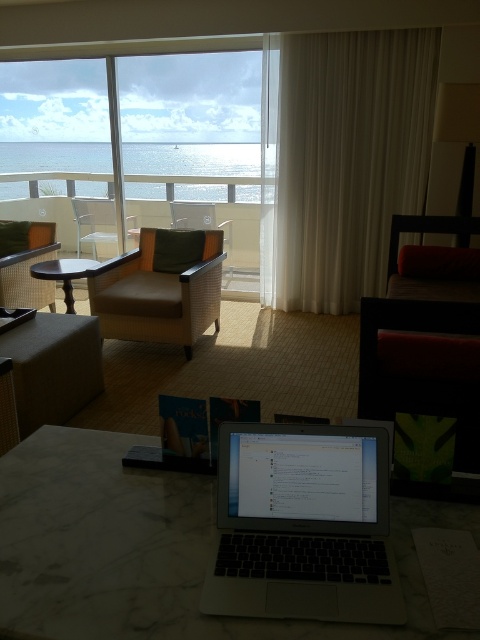
You are standing in the room and want to pick up an object located at point (342, 502) and another object at point (90, 228). Which point do you need to walk closer to first to reach them?

You should first walk closer to point (342, 502) because it is closer to you than point (90, 228).

You are a guest in this room and want to know which object is larger between the white sheer curtain at right and the matte brown armchair at center. Can you tell me?

The white sheer curtain at right is bigger than the matte brown armchair at center according to the description.

You are a guest in this room and want to know which object is taller between the white sheer curtain at right and the matte brown armchair at center. Can you tell me?

The white sheer curtain at right is taller than the matte brown armchair at center.